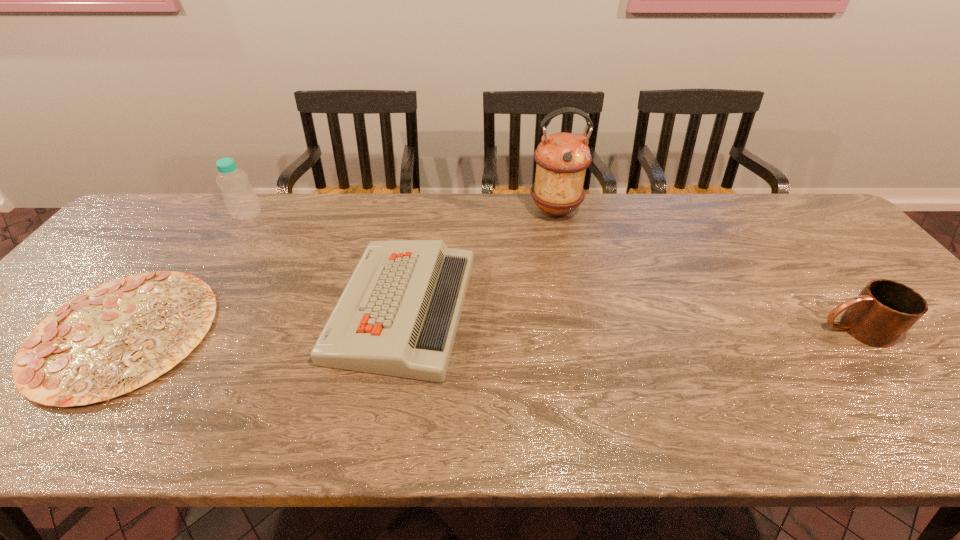
Locate an element on the screen. The width and height of the screenshot is (960, 540). vacant region between the second shortest object and the mug is located at coordinates (629, 319).

What are the coordinates of `vacant space that's between the oil lamp and the third tallest object` in the screenshot? It's located at (705, 270).

This screenshot has width=960, height=540. What are the coordinates of `vacant space that's between the third shortest object and the second shortest object` in the screenshot? It's located at (629, 319).

The image size is (960, 540). I want to click on vacant region between the computer keyboard and the second object from right to left, so click(x=479, y=259).

The width and height of the screenshot is (960, 540). What are the coordinates of `vacant area between the mug and the third object from left to right` in the screenshot? It's located at (629, 319).

This screenshot has width=960, height=540. What are the coordinates of `free spot between the second tallest object and the tallest object` in the screenshot? It's located at (401, 213).

Identify the location of object that is the nearest to the fourth object from left to right. (398, 315).

Locate an element on the screen. the fourth closest object to the fourth tallest object is located at coordinates (885, 310).

Find the location of a particular element. This screenshot has height=540, width=960. free space that satisfies the following two spatial constraints: 1. on the back side of the fourth shortest object; 2. on the right side of the oil lamp is located at coordinates (251, 211).